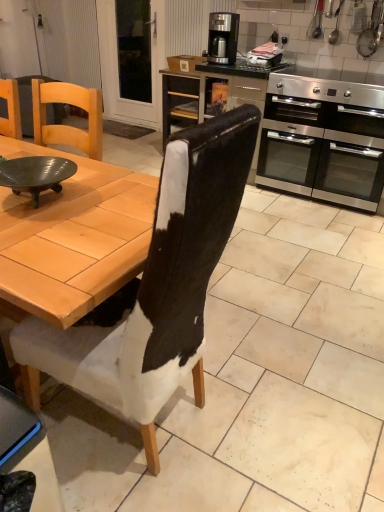
You are a GUI agent. You are given a task and a screenshot of the screen. Output one action in this format:
    pyautogui.click(x=<x>, y=<y>)
    Task: Click on the vacant space in between black leather chair at center and stainless steel oven at right
    The image size is (384, 512).
    Given the screenshot: What is the action you would take?
    pyautogui.click(x=279, y=263)